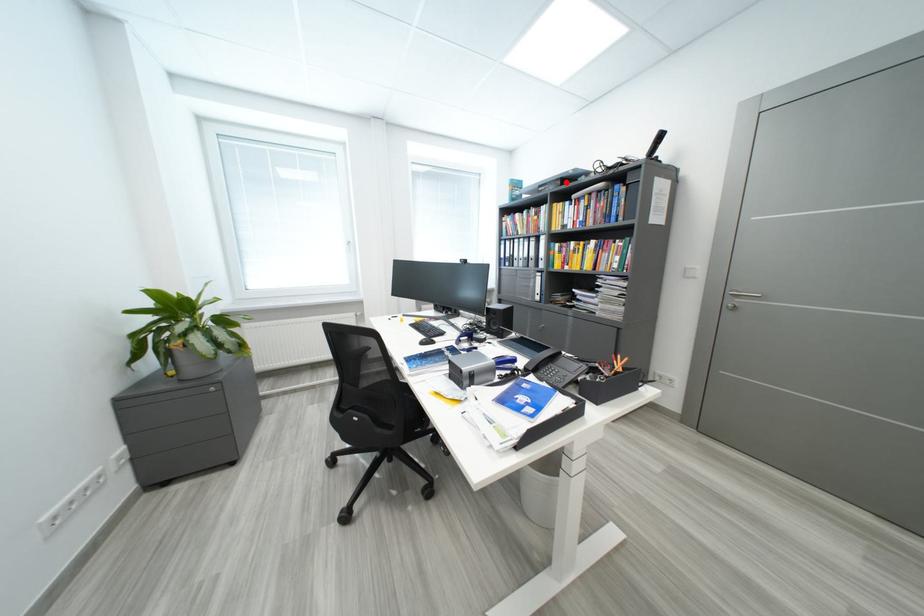
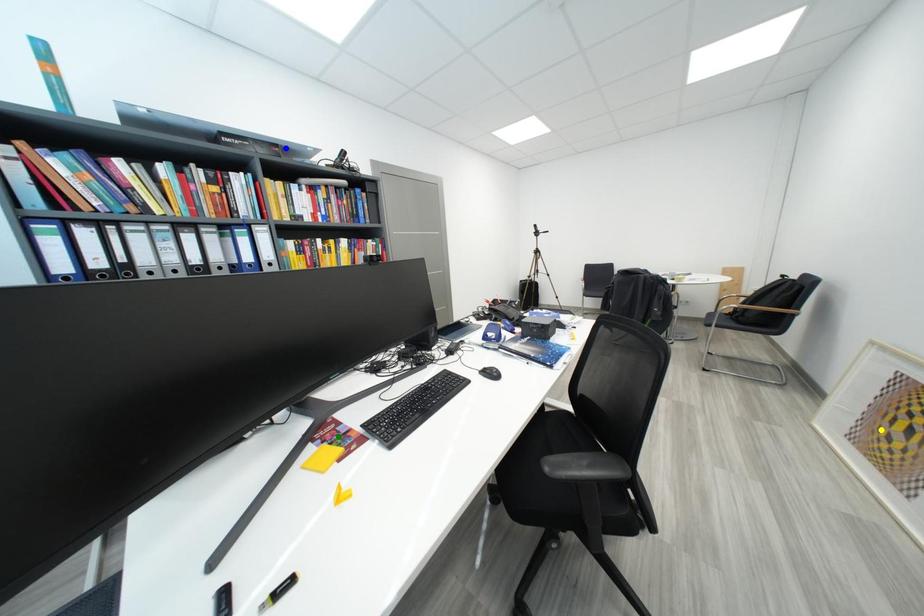
Question: I am providing you with two images of the same scene from different viewpoints. A red point is marked on the first image. You are given multiple points on the second image. Which point in image 2 represents the same 3d spot as the red point in image 1?

Choices:
 (A) yellow point
 (B) green point
 (C) blue point

Answer: (C)